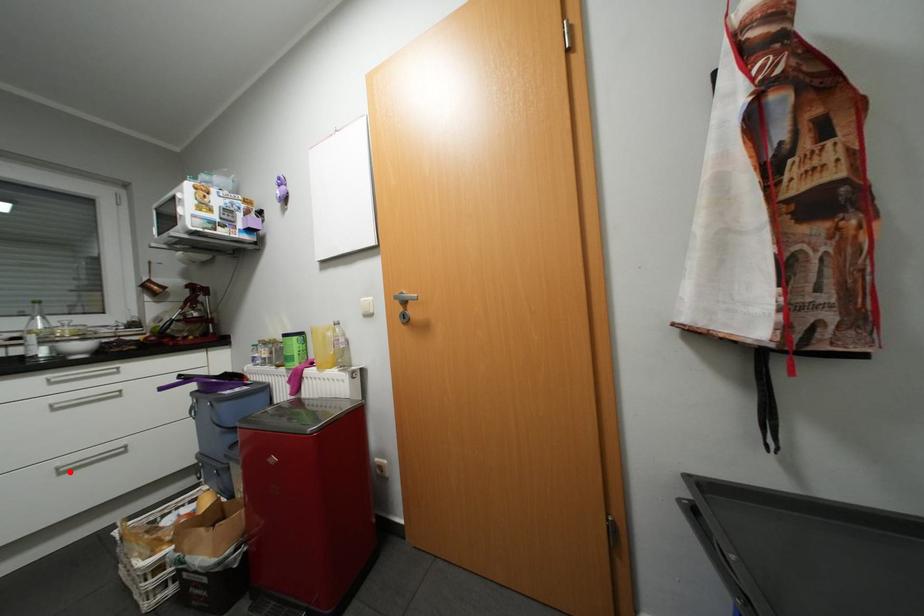
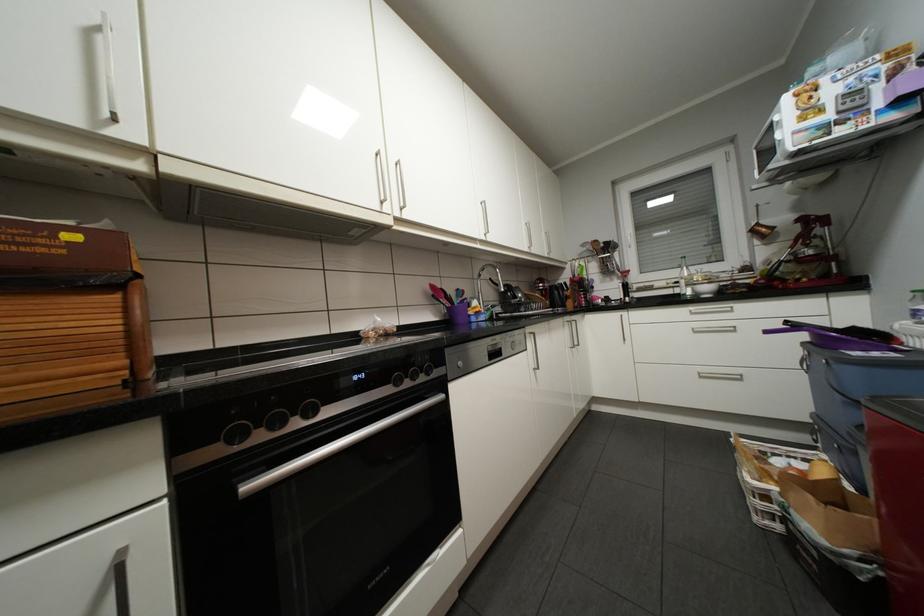
Question: I am providing you with two images of the same scene from different viewpoints. Given a red point in image1, look at the same physical point in image2. Is it:

Choices:
 (A) Closer to the viewpoint
 (B) Farther from the viewpoint

Answer: (B)